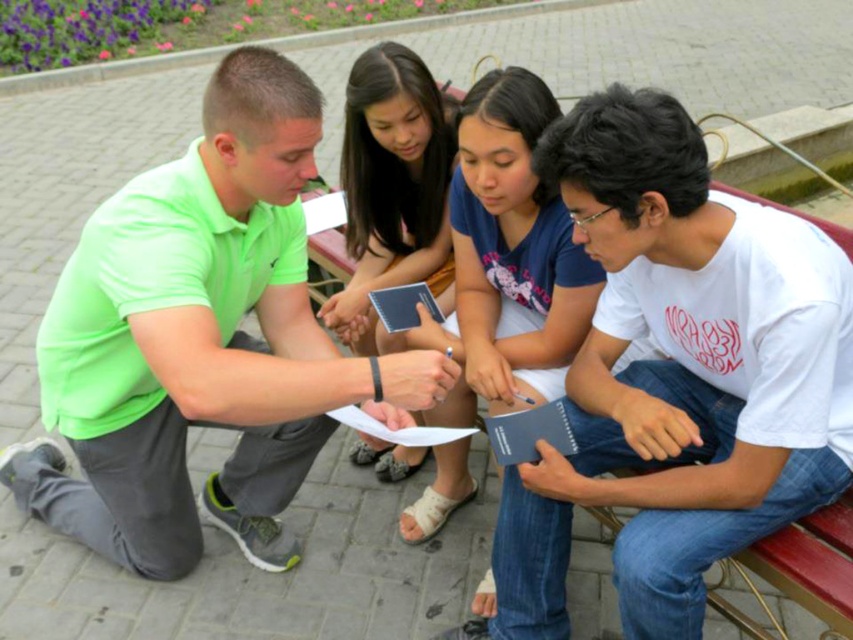
You are a photographer trying to capture a closeup shot of the white matte shirt at center and the blue matte notebook at center. Your camera has a maximum focus range of 15 inches. Will you be able to focus on both objects simultaneously?

The white matte shirt at center and blue matte notebook at center are 14.82 inches apart from each other, so yes, the camera can focus on both objects since the distance between them is within the 15 inch maximum focus range.

In the scene shown: You are standing in the park and see two points marked on the ground. The first point is at coordinate point [555,554] and the second is at point [486,321]. Which point is closer to you?

Point [555,554] is closer to the viewer than point [486,321].